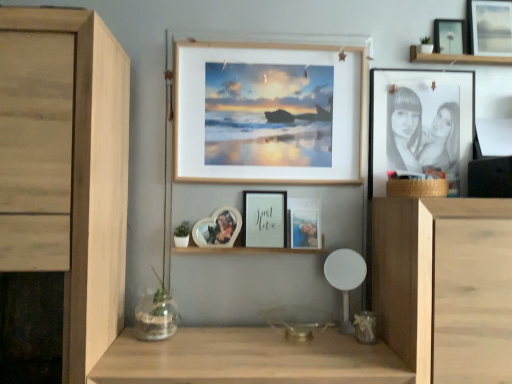
The width and height of the screenshot is (512, 384). What do you see at coordinates (218, 228) in the screenshot? I see `heart-shaped photo frame at center, positioned as the 1th picture frame in left-to-right order` at bounding box center [218, 228].

The height and width of the screenshot is (384, 512). I want to click on heart-shaped photo frame at center, the 6th picture frame positioned from the right, so click(218, 228).

Looking at this image, measure the distance between matte black picture frame at upper right, placed as the first picture frame when sorted from right to left, and camera.

matte black picture frame at upper right, placed as the first picture frame when sorted from right to left, is 5.36 feet away from camera.

You are a GUI agent. You are given a task and a screenshot of the screen. Output one action in this format:
    pyautogui.click(x=<x>, y=<y>)
    Task: Click on the matte black picture frame at upper right, the 6th picture frame viewed from the left
    
    Given the screenshot: What is the action you would take?
    pyautogui.click(x=489, y=28)

This screenshot has width=512, height=384. I want to click on light brown wood cabinet at lower right, the second cabinetry in the left-to-right sequence, so click(x=434, y=274).

I want to click on white matte chair at center, so click(x=345, y=278).

From the image's perspective, is matte black picture frame at upper right, the 6th picture frame viewed from the left, on top of clear glass vase at lower left?

Correct, matte black picture frame at upper right, the 6th picture frame viewed from the left, appears higher than clear glass vase at lower left in the image.

Considering the sizes of objects matte black picture frame at upper right, the 6th picture frame viewed from the left, and clear glass vase at lower left in the image provided, who is shorter, matte black picture frame at upper right, the 6th picture frame viewed from the left, or clear glass vase at lower left?

clear glass vase at lower left is shorter.

From a real-world perspective, who is located lower, matte black picture frame at upper right, the 6th picture frame viewed from the left, or clear glass vase at lower left?

clear glass vase at lower left.

Based on the photo, visually, is matte black picture frame at upper right, the 6th picture frame viewed from the left, positioned to the left or to the right of clear glass vase at lower left?

From the image, it's evident that matte black picture frame at upper right, the 6th picture frame viewed from the left, is to the right of clear glass vase at lower left.

From the image's perspective, is wooden frame at upper center, the fourth picture frame when ordered from right to left, located above white matte chair at center?

Yes.

Which of these two, wooden frame at upper center, the fourth picture frame when ordered from right to left, or white matte chair at center, is bigger?

wooden frame at upper center, the fourth picture frame when ordered from right to left.

Is wooden frame at upper center, the fourth picture frame when ordered from right to left, situated inside white matte chair at center or outside?

wooden frame at upper center, the fourth picture frame when ordered from right to left, is outside white matte chair at center.

Is wooden frame at upper center, the third picture frame from the left, facing away from white matte chair at center?

wooden frame at upper center, the third picture frame from the left, does not have its back to white matte chair at center.

I want to click on the 1st picture frame counting from the left side of the metallic silver photo frame at center, which is the third picture frame from right to left, so click(x=268, y=113).

Does metallic silver photo frame at center, the 4th picture frame positioned from the left, touch wooden frame at upper center, the third picture frame from the left?

No, metallic silver photo frame at center, the 4th picture frame positioned from the left, is not beside wooden frame at upper center, the third picture frame from the left.

From the image's perspective, which object appears higher, metallic silver photo frame at center, which is the third picture frame from right to left, or wooden frame at upper center, the third picture frame from the left?

wooden frame at upper center, the third picture frame from the left.

Does metallic silver photo frame at center, the 4th picture frame positioned from the left, have a larger size compared to wooden frame at upper center, the third picture frame from the left?

No.

How distant is matte black picture frame at upper right, which is counted as the second picture frame, starting from the right, from clear glass vase at lower left?

matte black picture frame at upper right, which is counted as the second picture frame, starting from the right, is 1.46 meters from clear glass vase at lower left.

From the picture: Is clear glass vase at lower left at the back of matte black picture frame at upper right, which is counted as the second picture frame, starting from the right?

matte black picture frame at upper right, which is counted as the second picture frame, starting from the right, does not have its back to clear glass vase at lower left.

Is matte black picture frame at upper right, which is counted as the second picture frame, starting from the right, to the left of clear glass vase at lower left from the viewer's perspective?

No.

Considering the relative sizes of matte black picture frame at upper right, marked as the 5th picture frame in a left-to-right arrangement, and clear glass vase at lower left in the image provided, is matte black picture frame at upper right, marked as the 5th picture frame in a left-to-right arrangement, thinner than clear glass vase at lower left?

Yes.

In the scene shown: From the image's perspective, is white matte chair at center above matte black picture frame at upper right, which is counted as the second picture frame, starting from the right?

Incorrect, from the image's perspective, white matte chair at center is lower than matte black picture frame at upper right, which is counted as the second picture frame, starting from the right.

Considering the sizes of white matte chair at center and matte black picture frame at upper right, marked as the 5th picture frame in a left-to-right arrangement, in the image, is white matte chair at center bigger or smaller than matte black picture frame at upper right, marked as the 5th picture frame in a left-to-right arrangement,?

In the image, white matte chair at center appears to be larger than matte black picture frame at upper right, marked as the 5th picture frame in a left-to-right arrangement.

Which is farther, (344,253) or (458,37)?

The point (458,37) is more distant.

Is white matte chair at center aimed at matte black picture frame at upper right, marked as the 5th picture frame in a left-to-right arrangement?

No, white matte chair at center is not turned towards matte black picture frame at upper right, marked as the 5th picture frame in a left-to-right arrangement.

Is light brown wood cabinet at lower right, the second cabinetry in the left-to-right sequence, a part of light wood cabinet at left, which is counted as the second cabinetry, starting from the right?

No.

Based on the photo, which object is further away from the camera taking this photo, light wood cabinet at left, which is the first cabinetry in left-to-right order, or light brown wood cabinet at lower right, acting as the first cabinetry starting from the right?

light brown wood cabinet at lower right, acting as the first cabinetry starting from the right, is behind.

Is point (100, 216) closer or farther from the camera than point (439, 352)?

Point (100, 216) is positioned farther from the camera compared to point (439, 352).

Considering the sizes of objects light wood cabinet at left, which is the first cabinetry in left-to-right order, and light brown wood cabinet at lower right, the second cabinetry in the left-to-right sequence, in the image provided, who is bigger, light wood cabinet at left, which is the first cabinetry in left-to-right order, or light brown wood cabinet at lower right, the second cabinetry in the left-to-right sequence,?

With larger size is light wood cabinet at left, which is the first cabinetry in left-to-right order.

Which object is thinner, white glossy photo frame at center or white matte chair at center?

white glossy photo frame at center is thinner.

Is white glossy photo frame at center not close to white matte chair at center?

white glossy photo frame at center is near white matte chair at center, not far away.

Is white glossy photo frame at center oriented away from white matte chair at center?

No, white glossy photo frame at center's orientation is not away from white matte chair at center.

Who is shorter, white glossy photo frame at center or white matte chair at center?

Standing shorter between the two is white glossy photo frame at center.

This screenshot has height=384, width=512. Find the location of `glass vase directly beneath the matte black picture frame at upper right, the 6th picture frame viewed from the left (from a real-world perspective)`. glass vase directly beneath the matte black picture frame at upper right, the 6th picture frame viewed from the left (from a real-world perspective) is located at coordinates (155, 316).

At what (x,y) coordinates should I click in order to perform the action: click on chair in front of the wooden frame at upper center, the fourth picture frame when ordered from right to left. Please return your answer as a coordinate pair (x, y). This screenshot has width=512, height=384. Looking at the image, I should click on (345, 278).

Based on their spatial positions, is matte black picture frame at upper right, the 6th picture frame viewed from the left, or white glossy photo frame at center further from clear glass vase at lower left?

matte black picture frame at upper right, the 6th picture frame viewed from the left, is positioned further to the anchor clear glass vase at lower left.

Based on their spatial positions, is light wood cabinet at left, which is counted as the second cabinetry, starting from the right, or white glossy photo frame at center closer to white matte picture frame at center, positioned as the 2th picture frame in left-to-right order?

white glossy photo frame at center is closer to white matte picture frame at center, positioned as the 2th picture frame in left-to-right order.

From the image, which object appears to be nearer to light wood cabinet at left, which is the first cabinetry in left-to-right order, matte black picture frame at upper right, marked as the 5th picture frame in a left-to-right arrangement, or matte black picture frame at upper right, placed as the first picture frame when sorted from right to left?

Among the two, matte black picture frame at upper right, marked as the 5th picture frame in a left-to-right arrangement, is located nearer to light wood cabinet at left, which is the first cabinetry in left-to-right order.

Considering their positions, is heart-shaped photo frame at center, the 6th picture frame positioned from the right, positioned closer to clear glass vase at lower left than light brown wood cabinet at lower right, acting as the first cabinetry starting from the right?

The object closer to clear glass vase at lower left is heart-shaped photo frame at center, the 6th picture frame positioned from the right.

Considering their positions, is white matte picture frame at center, positioned as the 2th picture frame in left-to-right order, positioned closer to matte black picture frame at upper right, marked as the 5th picture frame in a left-to-right arrangement, than white glossy photo frame at center?

Among the two, white matte picture frame at center, positioned as the 2th picture frame in left-to-right order, is located nearer to matte black picture frame at upper right, marked as the 5th picture frame in a left-to-right arrangement.

Considering their positions, is matte black picture frame at upper right, placed as the first picture frame when sorted from right to left, positioned further to white matte chair at center than white matte picture frame at center, positioned as the 2th picture frame in left-to-right order?

matte black picture frame at upper right, placed as the first picture frame when sorted from right to left, lies further to white matte chair at center than the other object.

From the image, which object appears to be nearer to light wood cabinet at left, which is counted as the second cabinetry, starting from the right, metallic silver photo frame at center, the 4th picture frame positioned from the left, or wooden frame at upper center, the third picture frame from the left?

Among the two, wooden frame at upper center, the third picture frame from the left, is located nearer to light wood cabinet at left, which is counted as the second cabinetry, starting from the right.

Estimate the real-world distances between objects in this image. Which object is further from light wood cabinet at left, which is the first cabinetry in left-to-right order, white glossy photo frame at center or matte black picture frame at upper right, which is counted as the second picture frame, starting from the right?

matte black picture frame at upper right, which is counted as the second picture frame, starting from the right.

Find the location of `shelf between matte black picture frame at upper right, placed as the first picture frame when sorted from right to left, and white matte chair at center from top to bottom`. shelf between matte black picture frame at upper right, placed as the first picture frame when sorted from right to left, and white matte chair at center from top to bottom is located at coordinates (244, 250).

This screenshot has width=512, height=384. What are the coordinates of `glass vase located between light wood cabinet at left, which is the first cabinetry in left-to-right order, and metallic silver photo frame at center, the 4th picture frame positioned from the left, in the left-right direction` in the screenshot? It's located at (155, 316).

Where is `chair between wooden frame at upper center, the third picture frame from the left, and clear glass vase at lower left in the up-down direction`? chair between wooden frame at upper center, the third picture frame from the left, and clear glass vase at lower left in the up-down direction is located at coordinates (345, 278).

The width and height of the screenshot is (512, 384). Identify the location of shelf located between light wood cabinet at left, which is the first cabinetry in left-to-right order, and light brown wood cabinet at lower right, acting as the first cabinetry starting from the right, in the left-right direction. (244, 250).